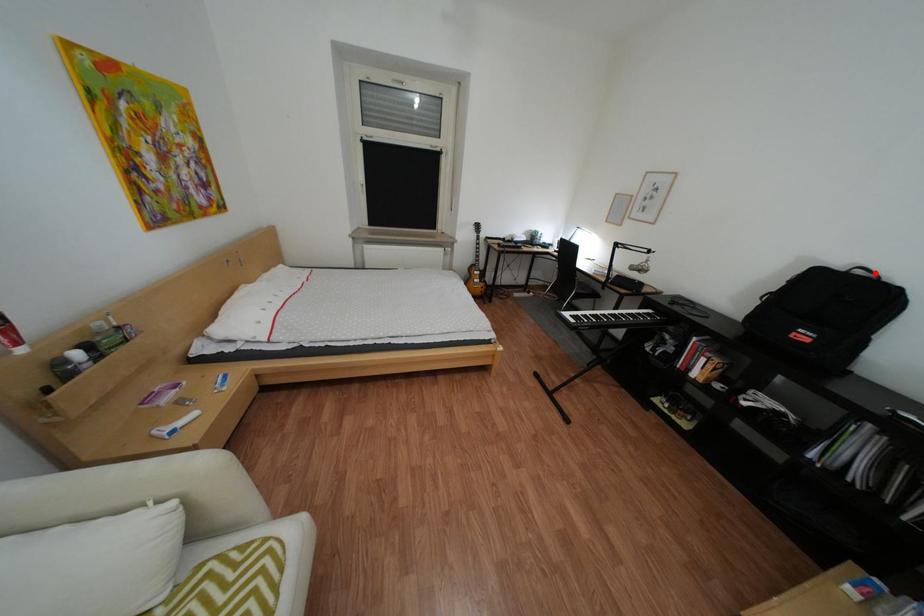
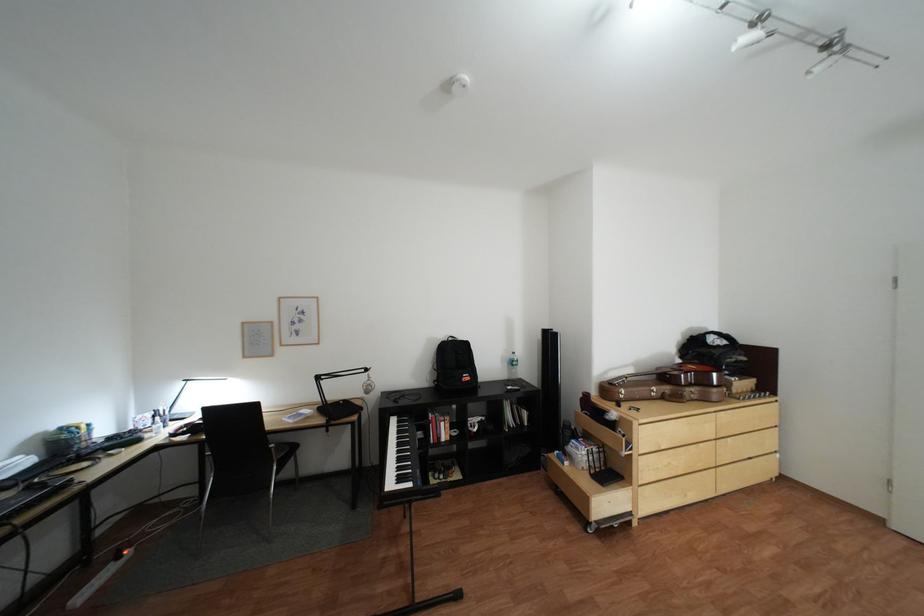
In the second image, find the point that corresponds to the highlighted location in the first image.

(466, 339)